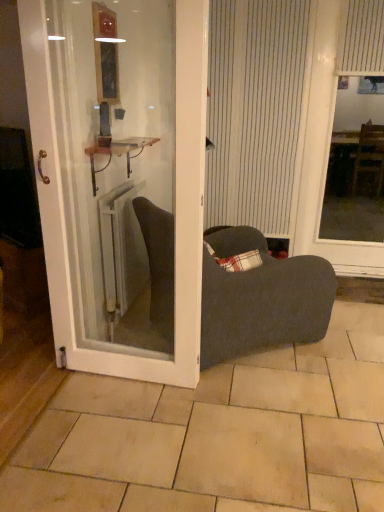
Question: Is white striped window screen at right to the left or to the right of metallic copper cabinet at center in the image?

Choices:
 (A) right
 (B) left

Answer: (A)

Question: Is point click(x=324, y=0) positioned closer to the camera than point click(x=147, y=138)?

Choices:
 (A) closer
 (B) farther

Answer: (A)

Question: Which object is the closest to the white glossy door at center?

Choices:
 (A) beige tile at center
 (B) white striped curtain at upper right, arranged as the second curtain when viewed from the left
 (C) white striped curtain at center, placed as the 2th curtain when sorted from right to left
 (D) white striped window screen at right
 (E) wooden frame mirror at upper center

Answer: (A)

Question: Considering the real-world distances, which object is closest to the white striped curtain at upper right, acting as the first curtain starting from the right?

Choices:
 (A) beige tile at center
 (B) white striped curtain at center, placed as the 2th curtain when sorted from right to left
 (C) wooden frame mirror at upper center
 (D) metallic copper cabinet at center
 (E) white metallic radiator at center

Answer: (B)